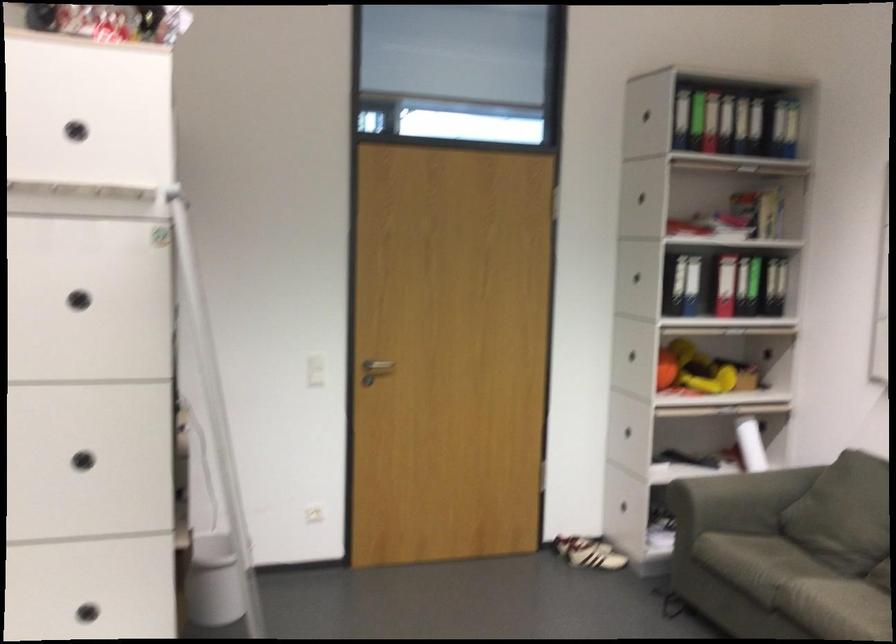
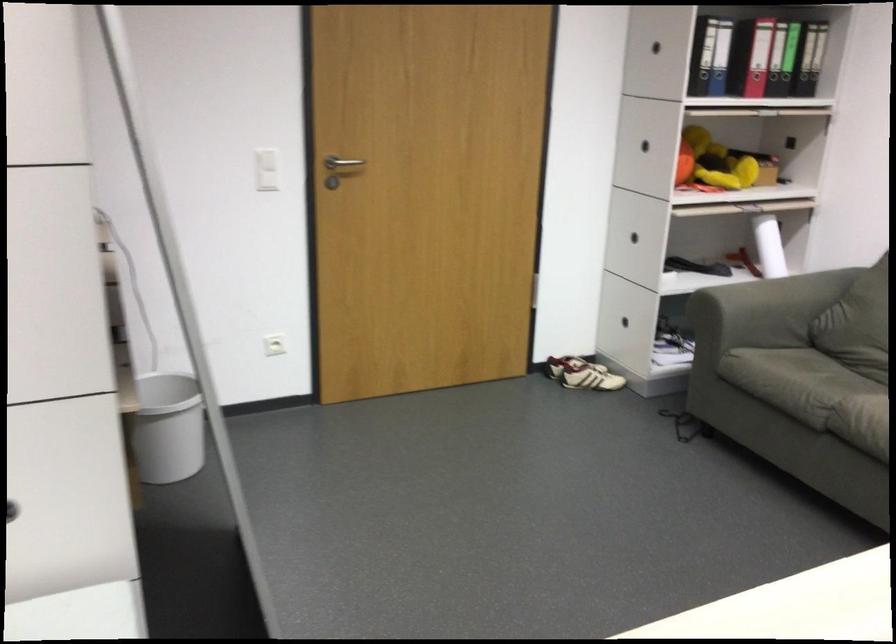
The images are taken continuously from a first-person perspective. In which direction are you moving?

The cameraman walked toward left, forward.